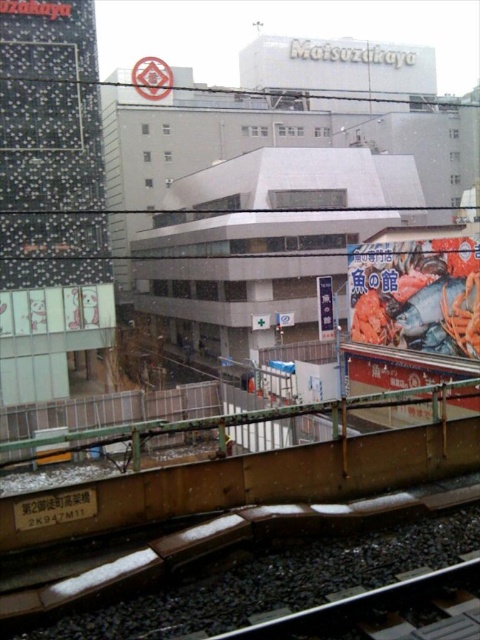
Between bright orange seafood at right and white paper sign at center, which one appears on the left side from the viewer's perspective?

white paper sign at center

Between point (443, 324) and point (316, 291), which one is positioned in front?

Point (443, 324) is in front.

Identify the location of bright orange seafood at right. This screenshot has width=480, height=640. (417, 294).